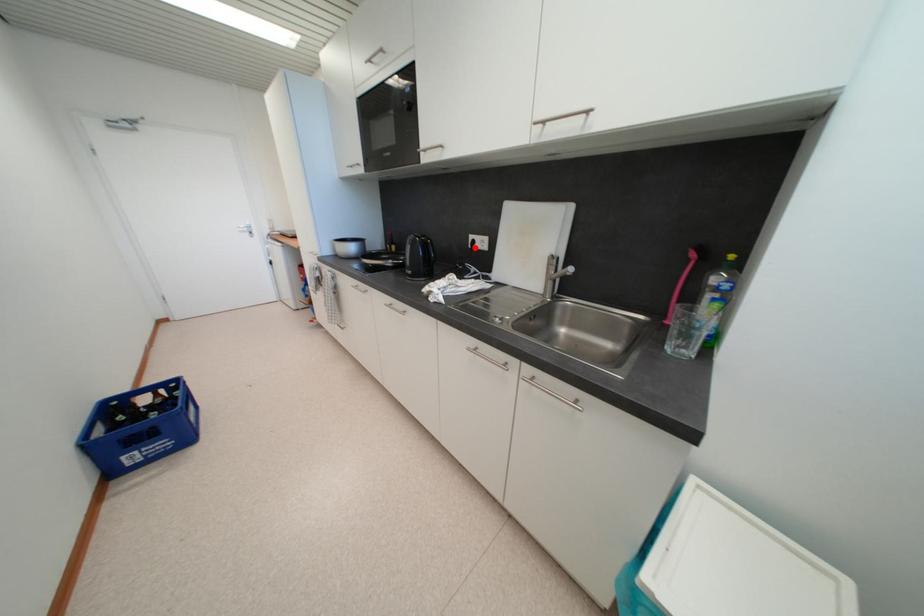
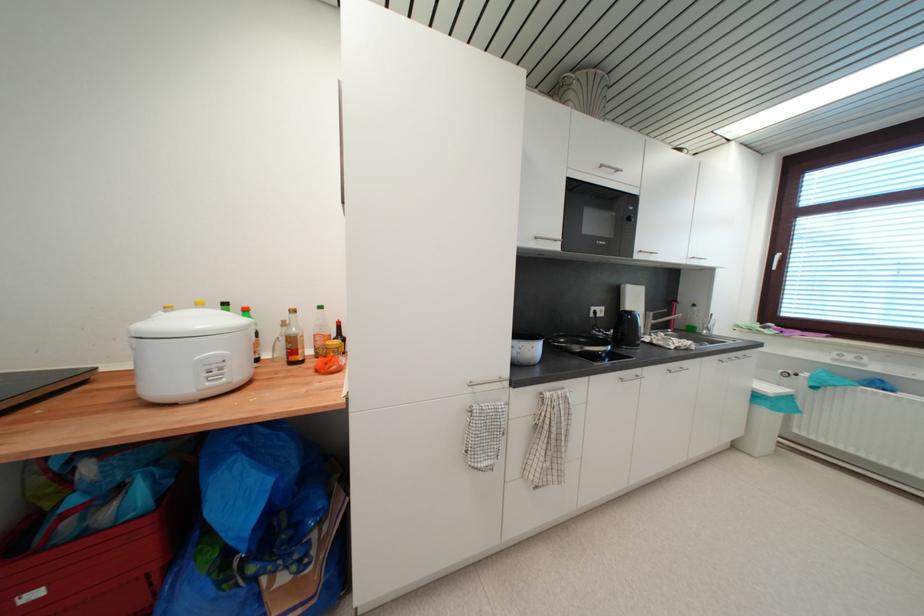
Question: I am providing you with two images of the same scene from different viewpoints. A red point is shown in image1. For the corresponding object point in image2, is it positioned nearer or farther from the camera?

Choices:
 (A) Nearer
 (B) Farther

Answer: (B)